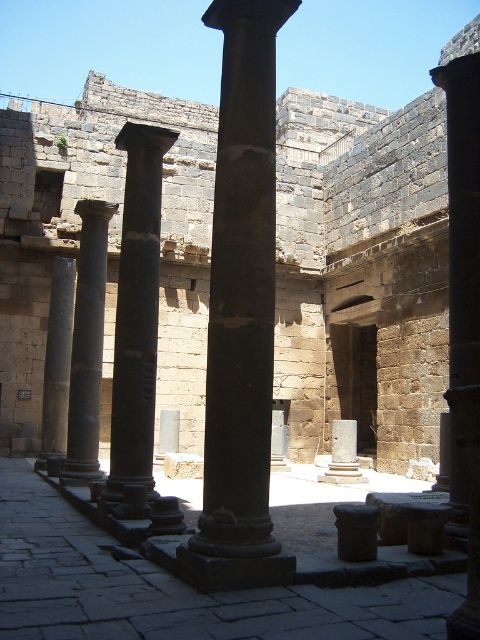
You are an archaeologist examining the ancient stone structure. You notice the black polished column at center and the dark gray stone column at left. Which column is located to the right of the other?

The black polished column at center is positioned on the right side of the dark gray stone column at left, so the black polished column at center is to the right of the dark gray stone column at left.

You are standing in front of the ancient stone structure. You see the black polished column at center and the dark gray stone column at left. Which column is nearer to you?

The black polished column at center is closer to the viewer than the dark gray stone column at left.

You are an archaeologist examining the ancient stone structure. You need to determine which column is wider between the black polished column at center and the smooth gray column at left. Based on the available information, can you conclude which one is wider?

The black polished column at center might be wider than smooth gray column at left according to the description.